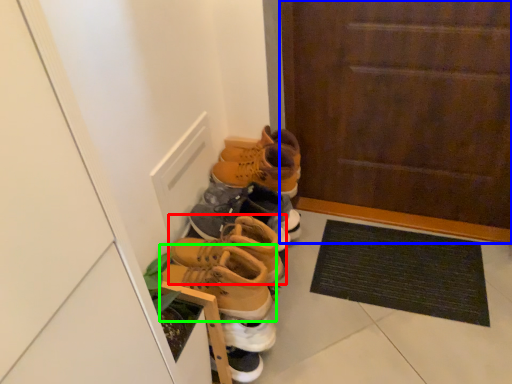
Question: Which is farther away from footwear (highlighted by a red box)? door (highlighted by a blue box) or footwear (highlighted by a green box)?

Choices:
 (A) door
 (B) footwear

Answer: (A)